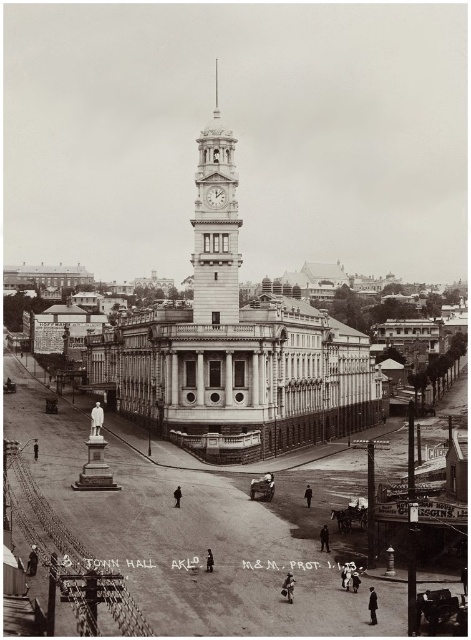
You are an architect analyzing this historical image. You need to determine which of the two structures, the white stone clock tower at center or the silver metallic spire at upper center, would require more materials to construct based on their sizes in the image. Which one would it be?

The white stone clock tower at center is larger in size than the silver metallic spire at upper center, so it would require more materials to construct.